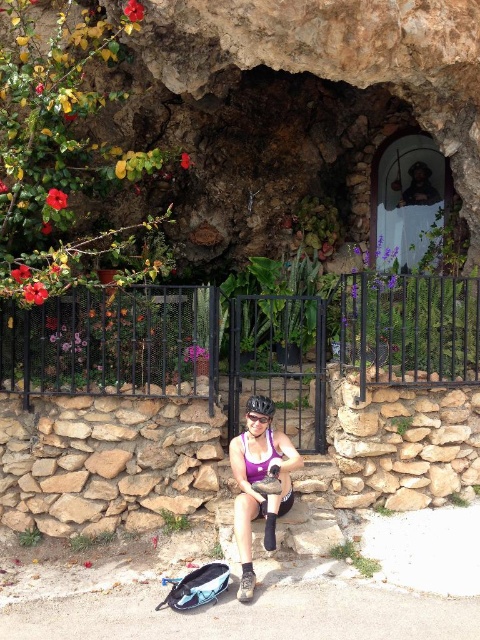
Question: Does matte purple tank top at center have a lesser width compared to black matte bicycle helmet at center?

Choices:
 (A) no
 (B) yes

Answer: (A)

Question: Which point appears farthest from the camera in this image?

Choices:
 (A) [254, 419]
 (B) [249, 401]

Answer: (B)

Question: Can you confirm if smooth stone statue at upper center is positioned to the right of transparent plastic goggles at center?

Choices:
 (A) no
 (B) yes

Answer: (B)

Question: Which object appears closest to the camera in this image?

Choices:
 (A) smooth stone statue at upper center
 (B) matte purple tank top at center
 (C) transparent plastic goggles at center

Answer: (B)

Question: Can you confirm if black metal fence at center is wider than matte purple tank top at center?

Choices:
 (A) no
 (B) yes

Answer: (B)

Question: Among these objects, which one is farthest from the camera?

Choices:
 (A) transparent plastic goggles at center
 (B) black matte bicycle helmet at center
 (C) matte purple tank top at center
 (D) smooth stone statue at upper center

Answer: (D)